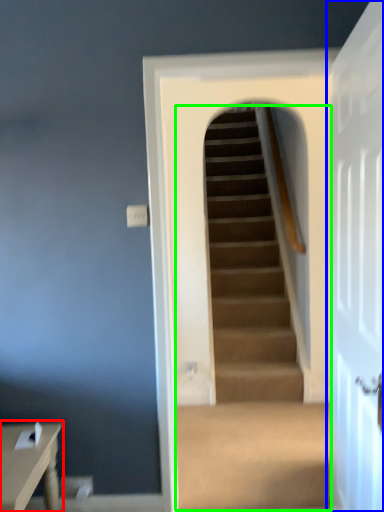
Question: Based on their relative distances, which object is farther from table (highlighted by a red box)? Choose from door (highlighted by a blue box) and escalator (highlighted by a green box).

Choices:
 (A) door
 (B) escalator

Answer: (B)